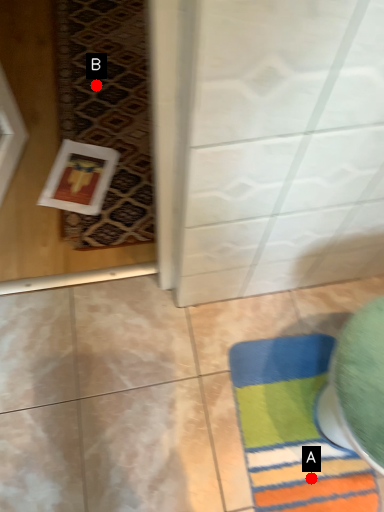
Question: Two points are circled on the image, labeled by A and B beside each circle. Which of the following is the closest to the observer?

Choices:
 (A) A is closer
 (B) B is closer

Answer: (A)